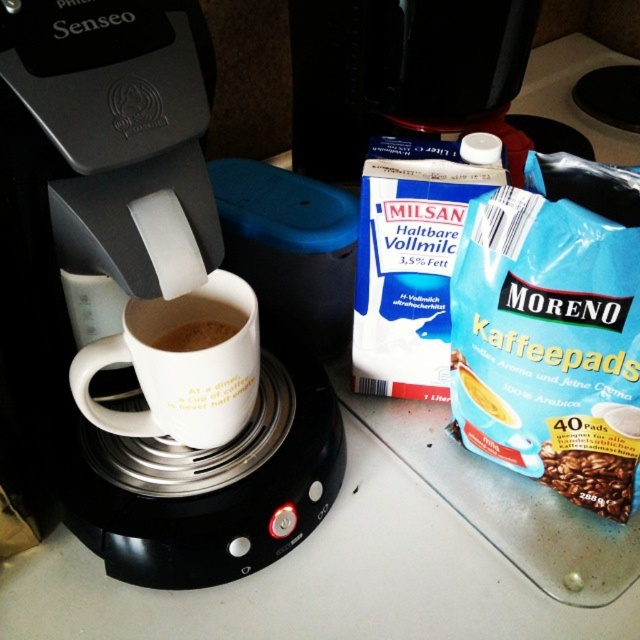
Question: Can you confirm if black plastic coffee machine at upper center is bigger than brown matte mug at center?

Choices:
 (A) no
 (B) yes

Answer: (B)

Question: Can you confirm if black plastic coffee machine at center is bigger than brown matte coffee beans at lower right?

Choices:
 (A) no
 (B) yes

Answer: (B)

Question: Which point is closer to the camera?

Choices:
 (A) (179, 337)
 (B) (230, 339)
 (C) (189, 108)

Answer: (C)

Question: Which object is farther from the camera taking this photo?

Choices:
 (A) black plastic coffee machine at upper center
 (B) white matte mug at center
 (C) black plastic coffee machine at center
 (D) brown matte coffee beans at lower right

Answer: (A)

Question: Is black plastic coffee machine at center in front of brown matte mug at center?

Choices:
 (A) no
 (B) yes

Answer: (B)

Question: Which of the following is the closest to the observer?

Choices:
 (A) (182, 388)
 (B) (392, 125)
 (C) (589, 460)

Answer: (A)